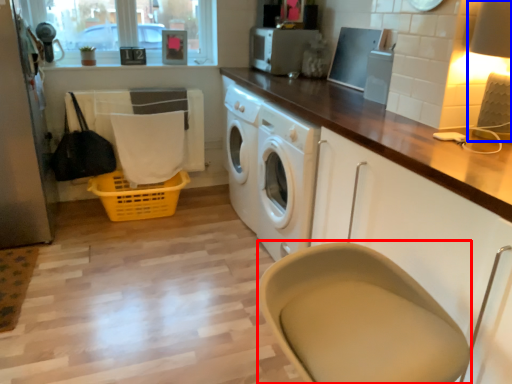
Question: Which object appears farthest to the camera in this image, feeding chair (highlighted by a red box) or lamp (highlighted by a blue box)?

Choices:
 (A) feeding chair
 (B) lamp

Answer: (B)